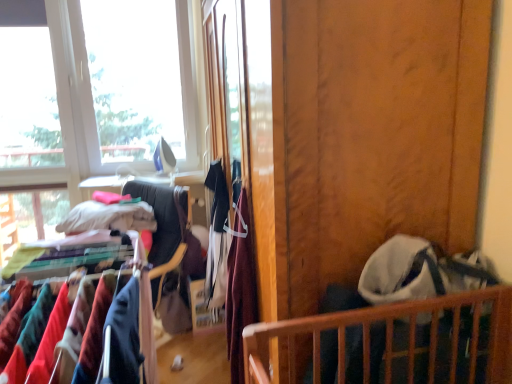
Question: Considering the relative positions of velvet fabric clothes at center and white cotton shirt at center, which is counted as the 1th clothing, starting from the left, in the image provided, is velvet fabric clothes at center to the left or to the right of white cotton shirt at center, which is counted as the 1th clothing, starting from the left,?

Choices:
 (A) left
 (B) right

Answer: (A)

Question: Considering the positions of velvet fabric clothes at center and white cotton shirt at center, arranged as the 2th clothing when viewed from the front, in the image, is velvet fabric clothes at center bigger or smaller than white cotton shirt at center, arranged as the 2th clothing when viewed from the front,?

Choices:
 (A) big
 (B) small

Answer: (A)

Question: Estimate the real-world distances between objects in this image. Which object is farther from the wooden screen door at center?

Choices:
 (A) white cotton shirt at center, the 2th clothing from the right
 (B) velvet burgundy dress at center, marked as the 1th clothing in a right-to-left arrangement
 (C) wooden crib at lower right
 (D) velvet fabric clothes at center

Answer: (D)

Question: Estimate the real-world distances between objects in this image. Which object is closer to the velvet burgundy dress at center, which is the second clothing from left to right?

Choices:
 (A) wooden crib at lower right
 (B) wooden screen door at center
 (C) velvet fabric clothes at center
 (D) white cotton shirt at center, arranged as the 2th clothing when viewed from the front

Answer: (D)